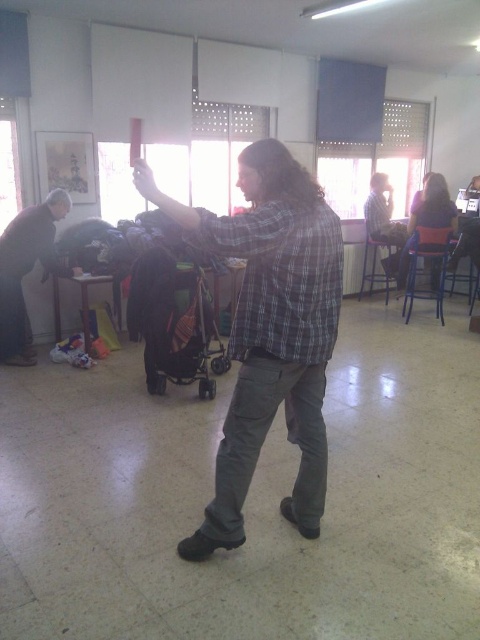
Question: From the image, what is the correct spatial relationship of plaid fabric shirt at center in relation to dark gray wool sweater at left?

Choices:
 (A) below
 (B) above

Answer: (A)

Question: Estimate the real-world distances between objects in this image. Which object is closer to the plaid fabric shirt at center?

Choices:
 (A) dark gray wool sweater at left
 (B) blue denim shirt at center

Answer: (A)

Question: Which object is the farthest from the dark gray wool sweater at left?

Choices:
 (A) blue denim shirt at center
 (B) plaid fabric shirt at center

Answer: (A)

Question: Is dark gray wool sweater at left behind blue denim shirt at center?

Choices:
 (A) yes
 (B) no

Answer: (B)

Question: Does plaid fabric shirt at center have a greater width compared to dark gray wool sweater at left?

Choices:
 (A) yes
 (B) no

Answer: (A)

Question: Which object is closer to the camera taking this photo?

Choices:
 (A) plaid fabric shirt at center
 (B) dark gray wool sweater at left

Answer: (A)